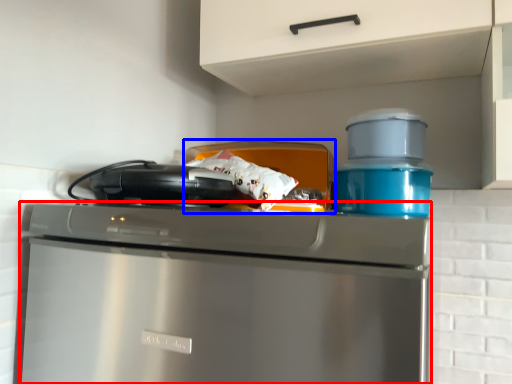
Question: Which object is further to the camera taking this photo, home appliance (highlighted by a red box) or appliance (highlighted by a blue box)?

Choices:
 (A) home appliance
 (B) appliance

Answer: (B)